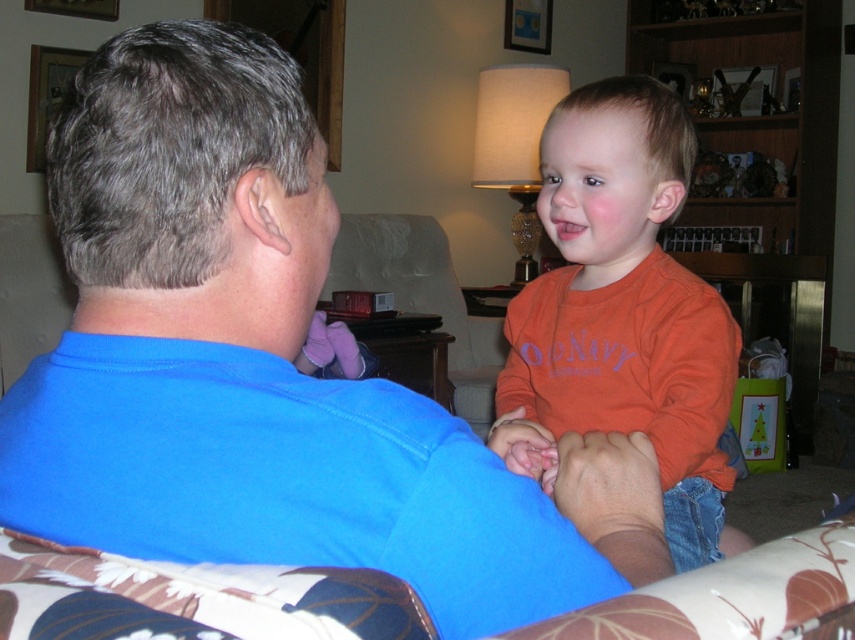
Who is higher up, blue cotton shirt at center or orange cotton shirt at center?

orange cotton shirt at center is above.

Is point (376, 436) less distant than point (663, 212)?

Yes, it is.

Identify the location of blue cotton shirt at center. Image resolution: width=855 pixels, height=640 pixels. (260, 365).